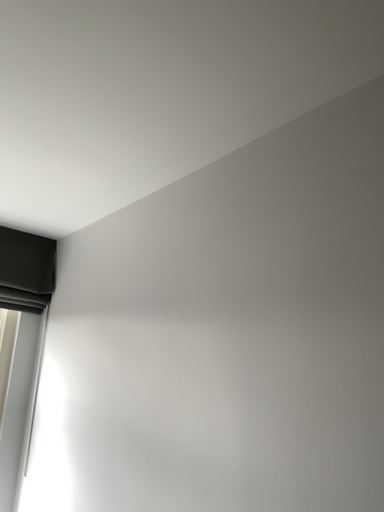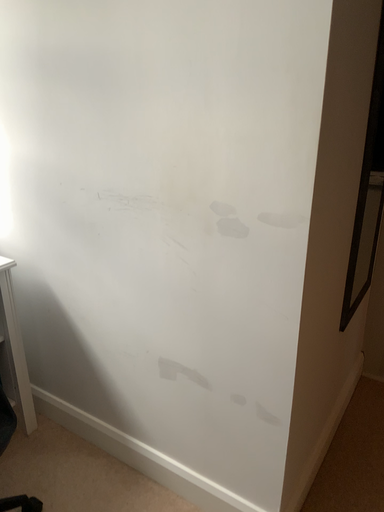
Question: How did the camera likely rotate when shooting the video?

Choices:
 (A) rotated downward
 (B) rotated upward

Answer: (A)